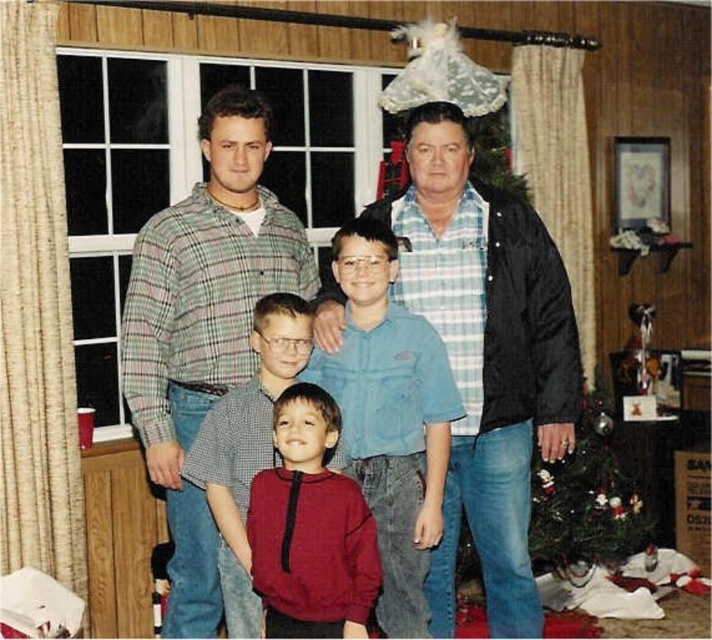
Does green plaid shirt at upper left have a larger size compared to blue denim shirt at center?

Yes.

Consider the image. Which is more to the left, green plaid shirt at upper left or blue denim shirt at center?

Positioned to the left is green plaid shirt at upper left.

Does point (246, 188) lie behind point (384, 269)?

That is True.

Find the location of a particular element. This screenshot has width=712, height=640. green plaid shirt at upper left is located at coordinates (204, 326).

Does matte blue shirt at center appear on the right side of green matte christmas tree at center?

No, matte blue shirt at center is not to the right of green matte christmas tree at center.

Looking at this image, does matte blue shirt at center have a lesser width compared to green matte christmas tree at center?

Indeed, matte blue shirt at center has a lesser width compared to green matte christmas tree at center.

In order to click on matte blue shirt at center in this screenshot , I will do `click(246, 448)`.

This screenshot has width=712, height=640. What are the coordinates of `matte blue shirt at center` in the screenshot? It's located at (246, 448).

Is point (513, 321) farther from viewer compared to point (192, 332)?

Yes, point (513, 321) is farther from viewer.

This screenshot has width=712, height=640. In order to click on blue plaid shirt at center in this screenshot , I will do `click(486, 356)`.